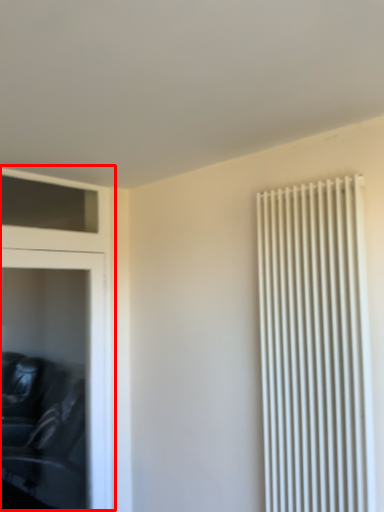
Question: In this image, where is dresser (annotated by the red box) located relative to radiator?

Choices:
 (A) left
 (B) right

Answer: (A)